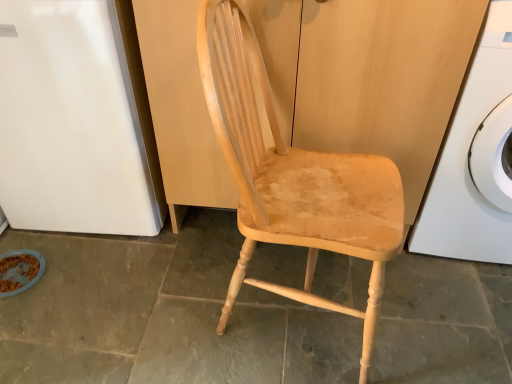
This screenshot has width=512, height=384. I want to click on vacant area that lies to the right of natural wood chair at center, so click(436, 322).